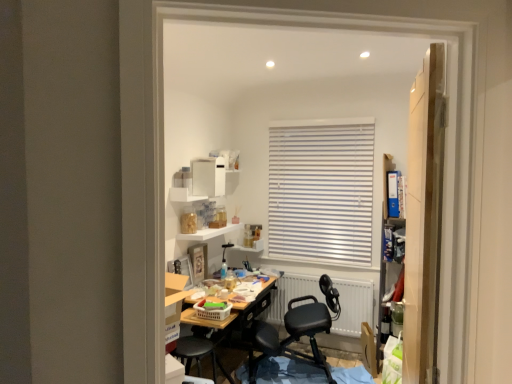
Where is `free space above white matte radiator at center (from a real-world perspective)`? free space above white matte radiator at center (from a real-world perspective) is located at coordinates (310, 268).